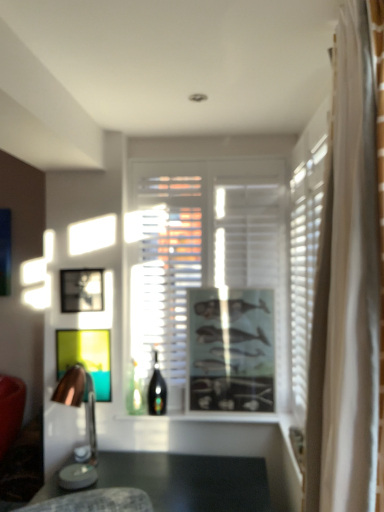
Question: Is wooden lampshade at left closer to camera compared to transparent glass window at center?

Choices:
 (A) no
 (B) yes

Answer: (B)

Question: Is wooden lampshade at left next to transparent glass window at center and touching it?

Choices:
 (A) yes
 (B) no

Answer: (B)

Question: Is wooden lampshade at left surrounding transparent glass window at center?

Choices:
 (A) yes
 (B) no

Answer: (B)

Question: Is wooden lampshade at left at the left side of transparent glass window at center?

Choices:
 (A) no
 (B) yes

Answer: (B)

Question: Does wooden lampshade at left have a larger size compared to transparent glass window at center?

Choices:
 (A) no
 (B) yes

Answer: (A)

Question: From a real-world perspective, is wooden lampshade at left over transparent glass window at center?

Choices:
 (A) yes
 (B) no

Answer: (B)

Question: From a real-world perspective, does matte black picture frame at center, the 3th picture frame when ordered from left to right, sit lower than transparent glass window at center?

Choices:
 (A) yes
 (B) no

Answer: (A)

Question: Does matte black picture frame at center, the 3th picture frame when ordered from left to right, have a larger size compared to transparent glass window at center?

Choices:
 (A) yes
 (B) no

Answer: (B)

Question: Can you see matte black picture frame at center, the 3th picture frame when ordered from left to right, touching transparent glass window at center?

Choices:
 (A) yes
 (B) no

Answer: (B)

Question: Can we say matte black picture frame at center, acting as the 1th picture frame starting from the right, lies outside transparent glass window at center?

Choices:
 (A) yes
 (B) no

Answer: (A)

Question: Can you confirm if matte black picture frame at center, acting as the 1th picture frame starting from the right, is positioned to the left of transparent glass window at center?

Choices:
 (A) no
 (B) yes

Answer: (A)

Question: Considering the relative sizes of wooden lampshade at left and metallic silver picture frame at center, marked as the third picture frame in a right-to-left arrangement, in the image provided, is wooden lampshade at left smaller than metallic silver picture frame at center, marked as the third picture frame in a right-to-left arrangement,?

Choices:
 (A) yes
 (B) no

Answer: (B)